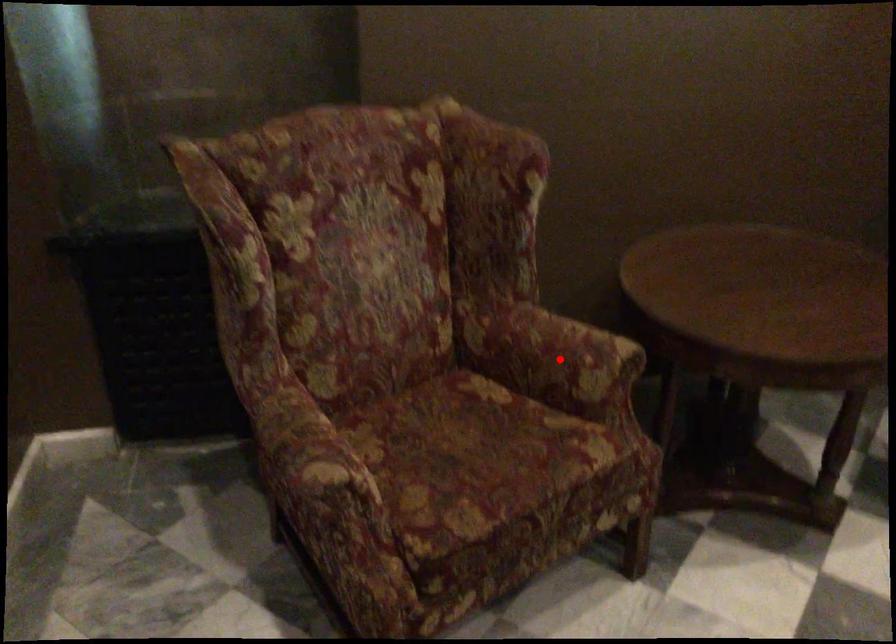
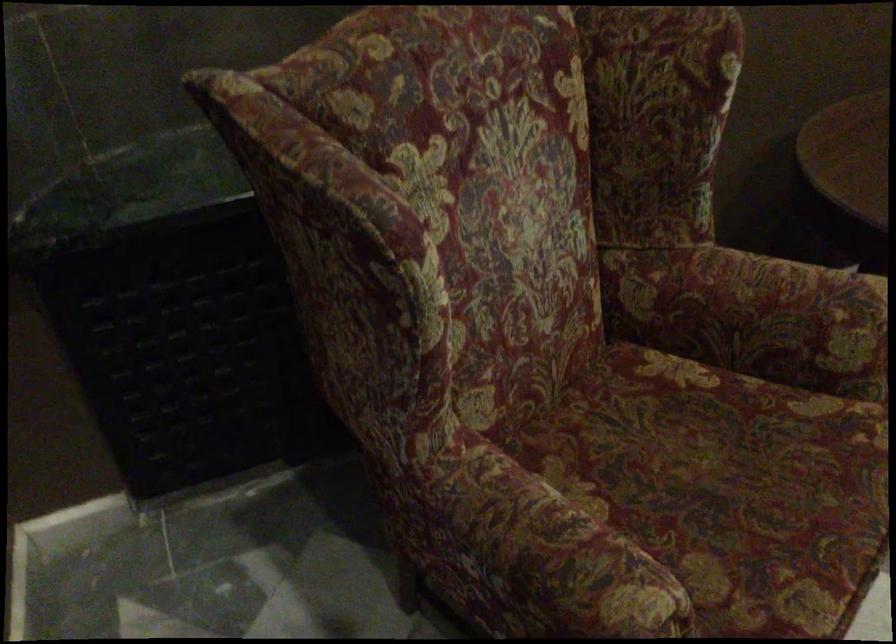
Question: I am providing you with two images of the same scene from different viewpoints. Image1 has a red point marked. In image2, the corresponding 3D location appears at what relative position? Reply with the corresponding letter.

Choices:
 (A) Closer
 (B) Farther

Answer: (A)